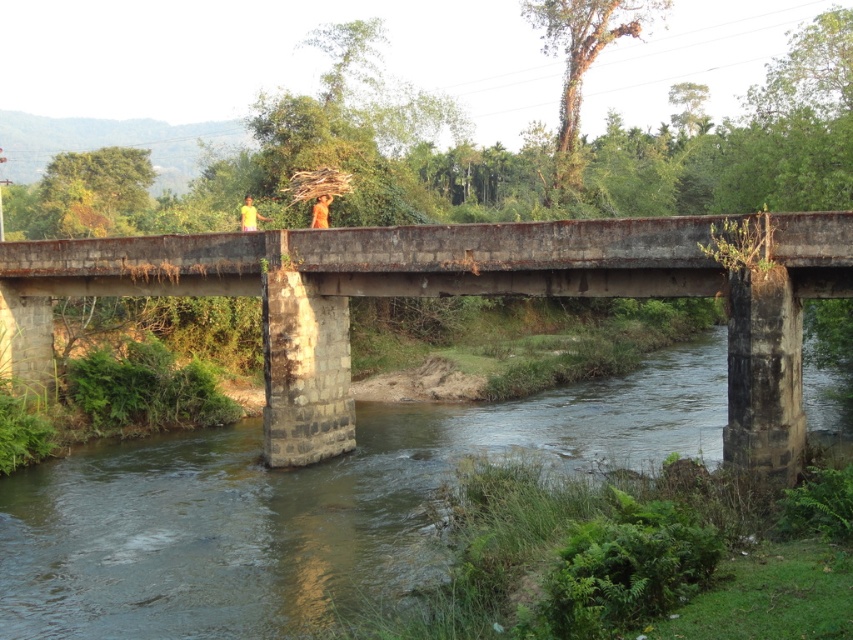
From the picture: You are a hiker standing on the bridge and want to take a photo of the orange fabric monk at center without including the brown concrete river at center in the background. Is this possible based on their positions?

The brown concrete river at center is closer to the viewer than orange fabric monk at center. Therefore, it would be challenging to capture the orange fabric monk at center without the brown concrete river at center appearing in the foreground of the photo.

From the picture: You are standing on the bridge and want to cross to the other side. The brown concrete river at center flows beneath the rusty concrete bridge at center. Which object is closer to you as you stand on the bridge?

The brown concrete river at center is closer to you because it is positioned in front of the rusty concrete bridge at center, meaning the river is between you and the bridge structure.